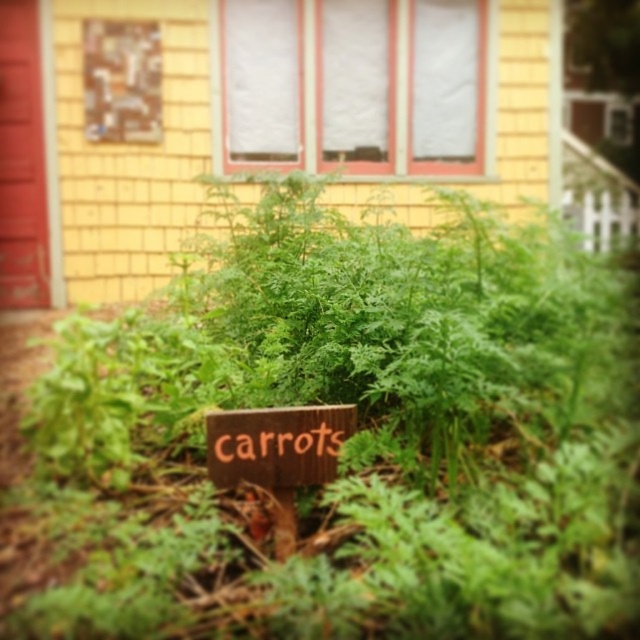
Is green leafy plant at center bigger than wooden sign at center?

Yes.

Which of these two, green leafy plant at center or wooden sign at center, stands taller?

green leafy plant at center

Is point (56, 403) more distant than point (234, 448)?

Yes.

You are a GUI agent. You are given a task and a screenshot of the screen. Output one action in this format:
    pyautogui.click(x=<x>, y=<y>)
    Task: Click on the green leafy plant at center
    
    Given the screenshot: What is the action you would take?
    pyautogui.click(x=349, y=436)